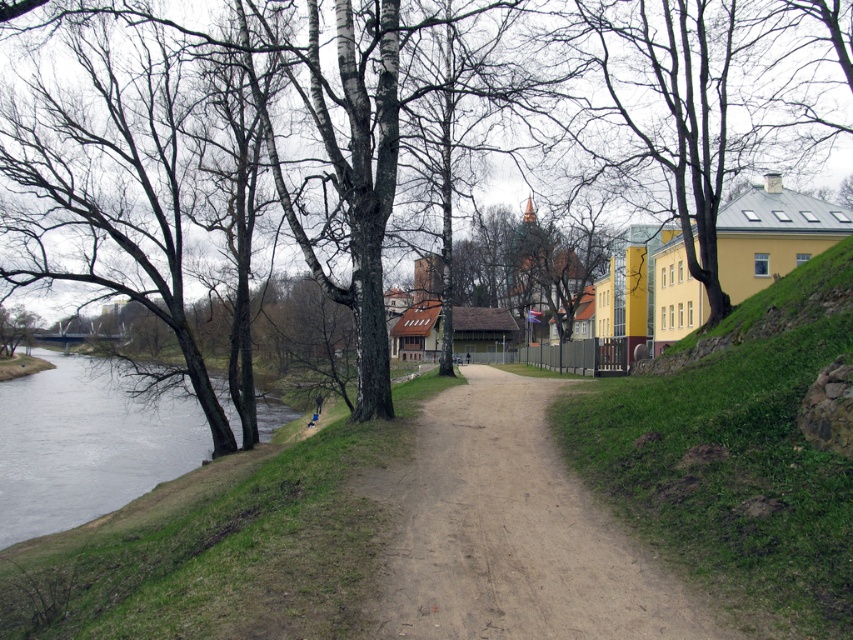
Who is taller, brown sandy dirt track at center or gray water at lower left?

gray water at lower left is taller.

Is brown sandy dirt track at center further to the viewer compared to gray water at lower left?

No, it is not.

Find the location of a particular element. brown sandy dirt track at center is located at coordinates (509, 532).

In order to click on brown sandy dirt track at center in this screenshot , I will do `click(509, 532)`.

From the picture: Which of these two, brown bark tree at left or gray water at lower left, stands shorter?

gray water at lower left

Is brown bark tree at left below gray water at lower left?

No, brown bark tree at left is not below gray water at lower left.

The image size is (853, 640). What are the coordinates of `brown bark tree at left` in the screenshot? It's located at (338, 150).

Can you confirm if brown bark tree at left is bigger than brown sandy dirt track at center?

Correct, brown bark tree at left is larger in size than brown sandy dirt track at center.

Can you confirm if brown bark tree at left is smaller than brown sandy dirt track at center?

Actually, brown bark tree at left might be larger than brown sandy dirt track at center.

Is point (503, 92) more distant than point (531, 627)?

Yes, point (503, 92) is behind point (531, 627).

This screenshot has width=853, height=640. I want to click on brown bark tree at left, so click(338, 150).